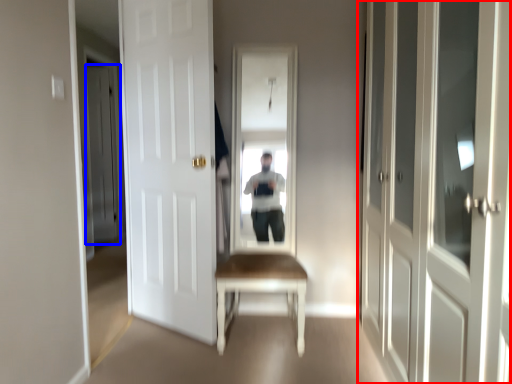
Question: Which point is closer to the camera, door (highlighted by a red box) or door (highlighted by a blue box)?

Choices:
 (A) door
 (B) door

Answer: (A)